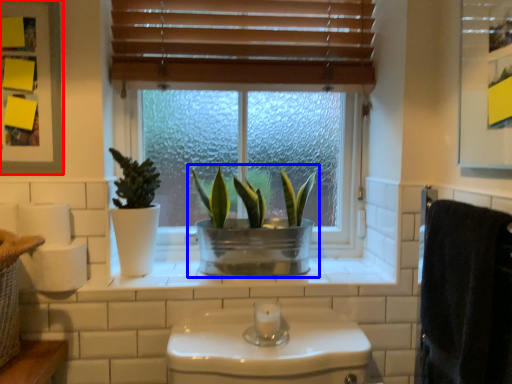
Question: Which point is closer to the camera, medicine cabinet (highlighted by a red box) or houseplant (highlighted by a blue box)?

Choices:
 (A) medicine cabinet
 (B) houseplant

Answer: (A)